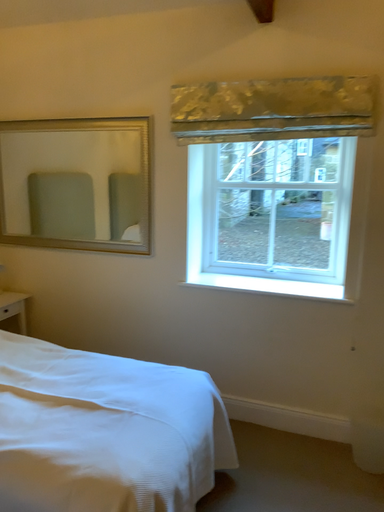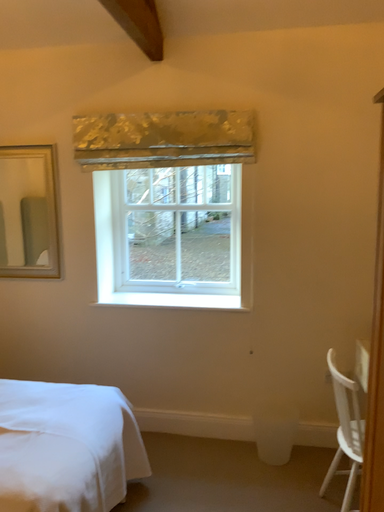
Question: How did the camera likely rotate when shooting the video?

Choices:
 (A) rotated right
 (B) rotated left

Answer: (A)